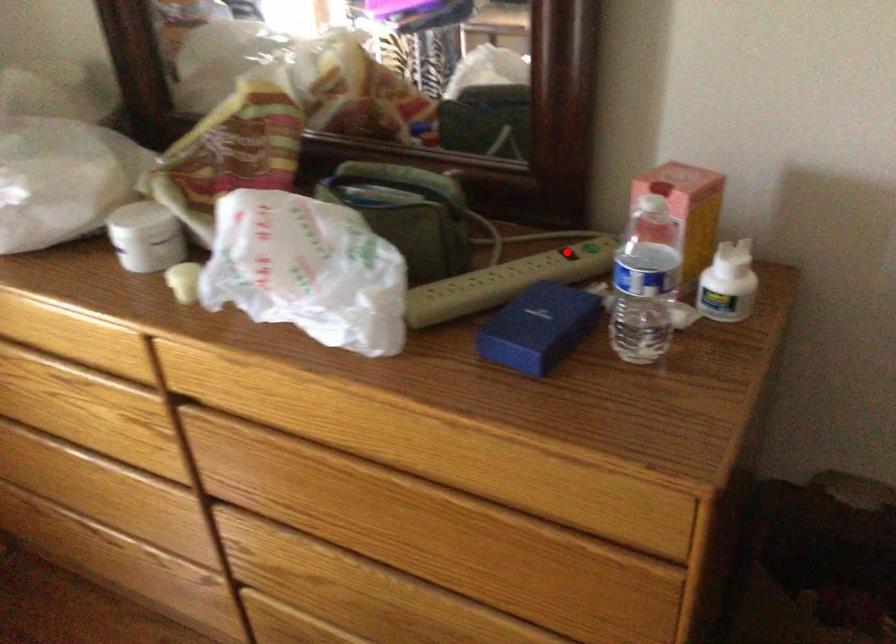
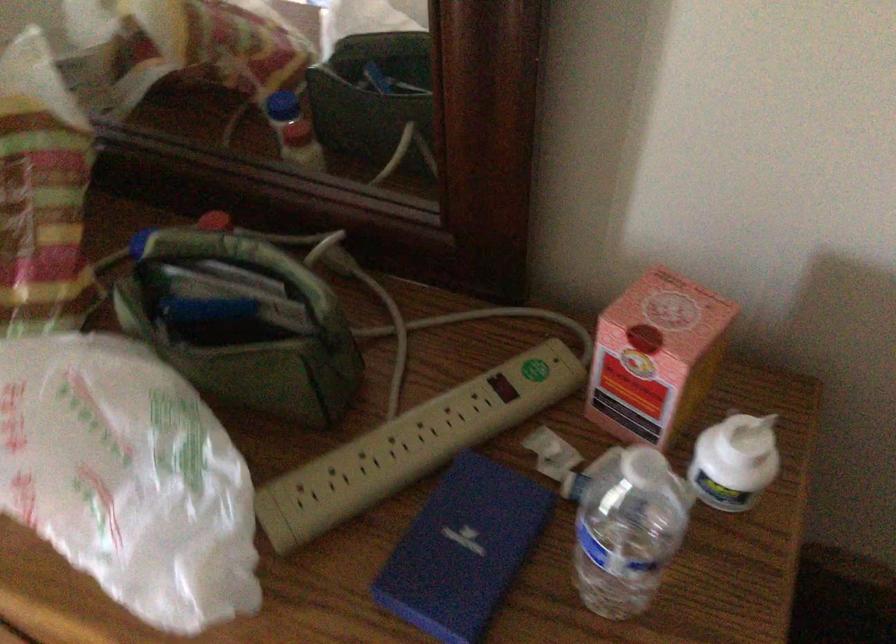
Find the pixel in the second image that matches the highlighted location in the first image.

(503, 386)